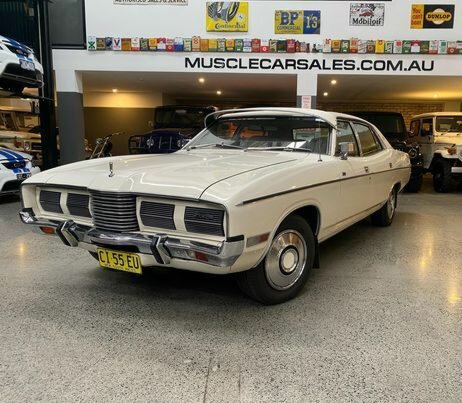
Locate an element on the screen. The height and width of the screenshot is (403, 462). floor is located at coordinates (89, 326).